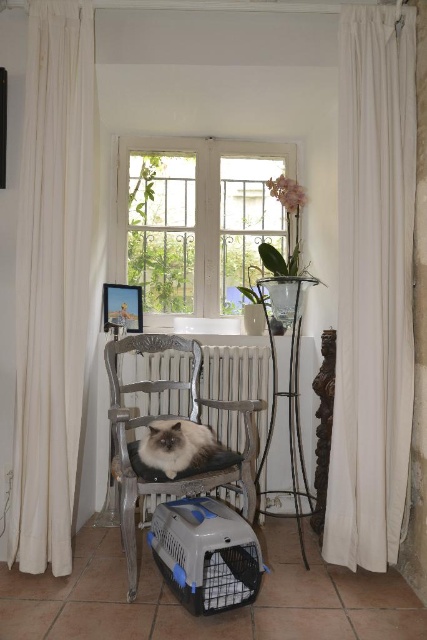
Does white sheer curtain at left have a lesser height compared to white metallic radiator at center?

In fact, white sheer curtain at left may be taller than white metallic radiator at center.

At what (x,y) coordinates should I click in order to perform the action: click on white sheer curtain at left. Please return your answer as a coordinate pair (x, y). Image resolution: width=427 pixels, height=640 pixels. Looking at the image, I should click on (52, 282).

I want to click on white sheer curtain at left, so click(52, 282).

Who is more forward, [81,168] or [202,525]?

Positioned in front is point [202,525].

Locate an element on the screen. The width and height of the screenshot is (427, 640). white sheer curtain at left is located at coordinates (52, 282).

The height and width of the screenshot is (640, 427). Find the location of `white sheer curtain at left`. white sheer curtain at left is located at coordinates (52, 282).

Between point (128, 241) and point (178, 442), which one is positioned behind?

Point (128, 241)

In the scene shown: Can you confirm if white glass window at center is smaller than fluffy gray cat at center?

No, white glass window at center is not smaller than fluffy gray cat at center.

The image size is (427, 640). Describe the element at coordinates (196, 220) in the screenshot. I see `white glass window at center` at that location.

Identify the location of white glass window at center. This screenshot has height=640, width=427. (196, 220).